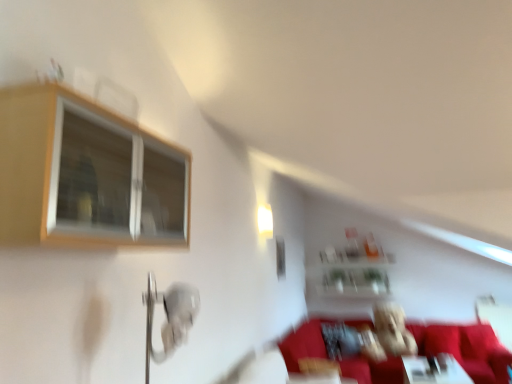
Question: Is wooden frame window at upper left completely or partially outside of white glossy light fixture at upper center?

Choices:
 (A) no
 (B) yes

Answer: (B)

Question: Is wooden frame window at upper left closer to camera compared to white glossy light fixture at upper center?

Choices:
 (A) yes
 (B) no

Answer: (A)

Question: Could you tell me if wooden frame window at upper left is turned towards white glossy light fixture at upper center?

Choices:
 (A) no
 (B) yes

Answer: (A)

Question: Is wooden frame window at upper left positioned far away from white glossy light fixture at upper center?

Choices:
 (A) no
 (B) yes

Answer: (B)

Question: From the image's perspective, does wooden frame window at upper left appear higher than white glossy light fixture at upper center?

Choices:
 (A) no
 (B) yes

Answer: (B)

Question: Do you think white glossy light fixture at upper center is within wooden frame window at upper left, or outside of it?

Choices:
 (A) inside
 (B) outside

Answer: (B)

Question: Considering the positions of white glossy light fixture at upper center and wooden frame window at upper left in the image, is white glossy light fixture at upper center wider or thinner than wooden frame window at upper left?

Choices:
 (A) thin
 (B) wide

Answer: (A)

Question: Does point (269, 225) appear closer or farther from the camera than point (47, 185)?

Choices:
 (A) farther
 (B) closer

Answer: (A)

Question: From their relative heights in the image, would you say white glossy light fixture at upper center is taller or shorter than wooden frame window at upper left?

Choices:
 (A) short
 (B) tall

Answer: (A)

Question: In the image, is clear glass shelf at upper center positioned in front of or behind white glossy table at lower right?

Choices:
 (A) front
 (B) behind

Answer: (B)

Question: From the image's perspective, relative to white glossy table at lower right, is clear glass shelf at upper center above or below?

Choices:
 (A) above
 (B) below

Answer: (A)

Question: Is clear glass shelf at upper center wider or thinner than white glossy table at lower right?

Choices:
 (A) wide
 (B) thin

Answer: (B)

Question: In the image, is clear glass shelf at upper center on the left side or the right side of white glossy table at lower right?

Choices:
 (A) right
 (B) left

Answer: (B)

Question: In the image, is white glossy table at lower right positioned in front of or behind fuzzy fabric teddy bear at center?

Choices:
 (A) front
 (B) behind

Answer: (A)

Question: From a real-world perspective, is white glossy table at lower right physically located above or below fuzzy fabric teddy bear at center?

Choices:
 (A) below
 (B) above

Answer: (A)